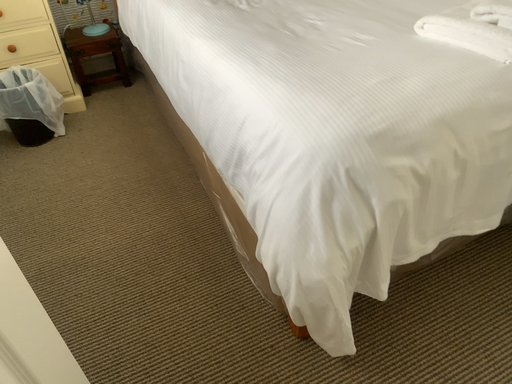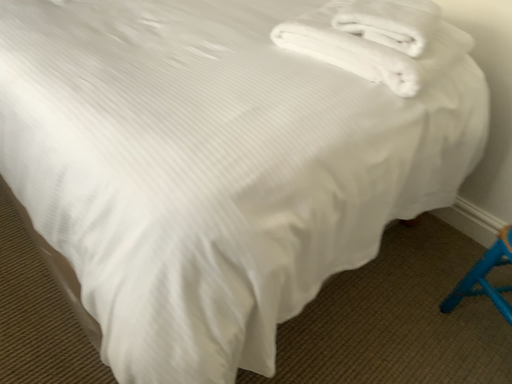
Question: How did the camera likely rotate when shooting the video?

Choices:
 (A) rotated right
 (B) rotated left

Answer: (A)